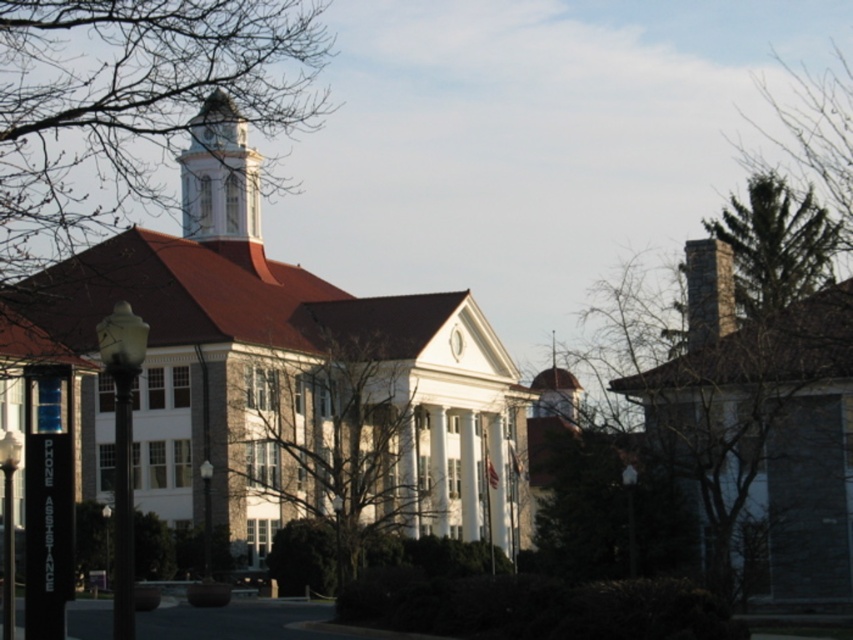
Question: Is white stone church at center to the right of green textured tree at upper right from the viewer's perspective?

Choices:
 (A) yes
 (B) no

Answer: (B)

Question: Does bare branches at center appear on the right side of green textured tree at upper right?

Choices:
 (A) no
 (B) yes

Answer: (A)

Question: Based on their relative distances, which object is nearer to the bare branches at center?

Choices:
 (A) green textured tree at upper right
 (B) white stone clock tower at upper center

Answer: (B)

Question: Which object appears farthest from the camera in this image?

Choices:
 (A) white stone clock tower at upper center
 (B) green textured tree at upper right
 (C) bare branches at center

Answer: (A)

Question: Which point is farther to the camera?

Choices:
 (A) white stone church at center
 (B) white stone clock tower at upper center
 (C) green textured tree at upper right
 (D) bare branches at center

Answer: (B)

Question: Does bare branches at center appear under white stone clock tower at upper center?

Choices:
 (A) yes
 (B) no

Answer: (A)